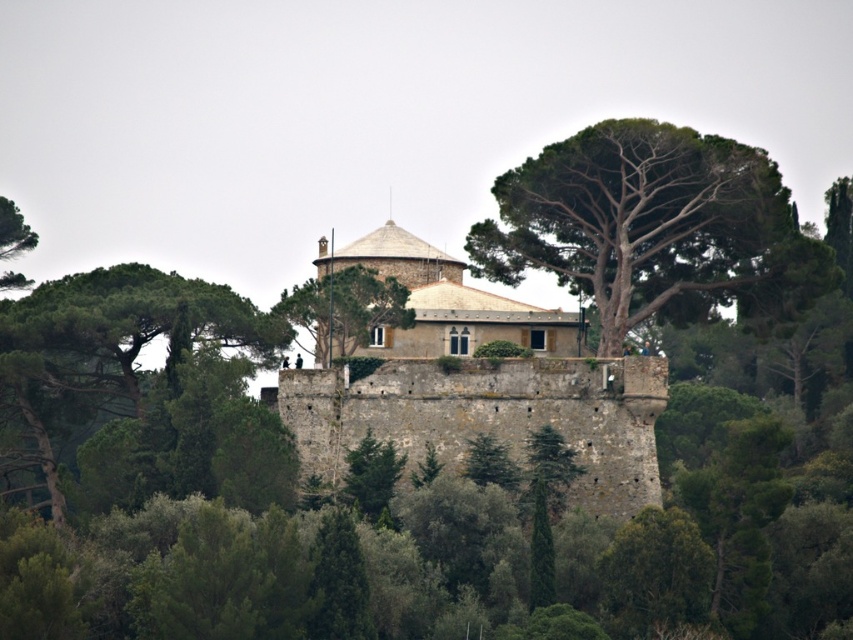
Consider the image. You are a drone operator tasked with capturing aerial footage of the stone castle at center. The green leafy tree at left is blocking your camera view. What is the minimum distance you need to fly the drone away from the tree to ensure the castle is fully visible?

The minimum distance you need to fly the drone away from the green leafy tree at left is 39.57 meters to ensure the stone castle at center is fully visible.

You are a hiker standing at the base of the green rough bark tree at center and the green leafy tree at center. Which tree is closer to the ground?

The green rough bark tree at center is positioned under green leafy tree at center, so the green rough bark tree at center is closer to the ground.

You are standing in front of the historic stone structure and want to determine the relative positions of two points marked on the building. Which point is closer to you, point (490, 269) or point (318, 301)?

Point (490, 269) is further to the viewer than point (318, 301), so the point closer to you is point (318, 301).